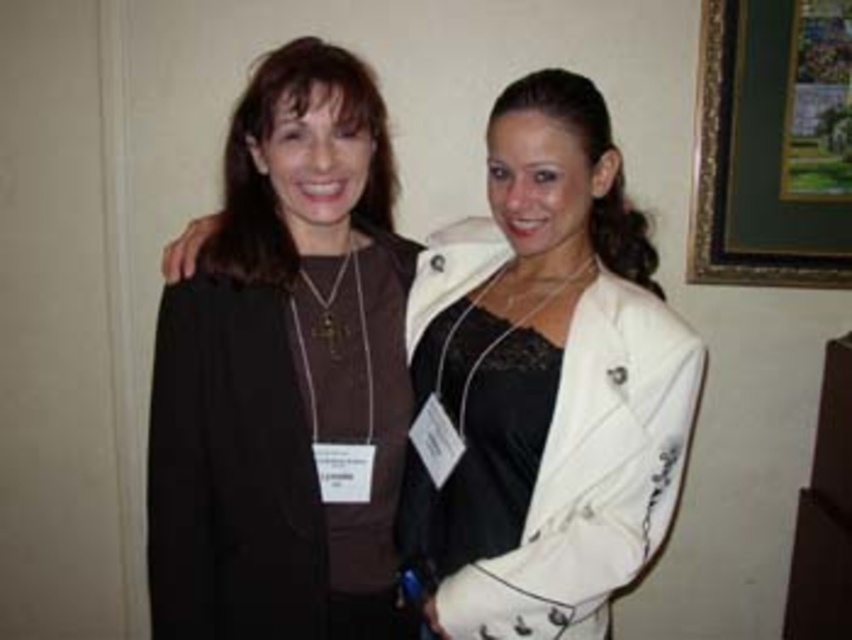
Can you confirm if matte brown sweater at center is smaller than gold-framed picture at upper right?

Actually, matte brown sweater at center might be larger than gold-framed picture at upper right.

This screenshot has height=640, width=852. What do you see at coordinates (544, 381) in the screenshot? I see `matte brown sweater at center` at bounding box center [544, 381].

Locate an element on the screen. This screenshot has width=852, height=640. matte brown sweater at center is located at coordinates (544, 381).

Does point (289, 541) come in front of point (632, 570)?

No, it is behind (632, 570).

Consider the image. Can you confirm if matte black jacket at left is bigger than matte brown sweater at center?

No.

Locate an element on the screen. The width and height of the screenshot is (852, 640). matte black jacket at left is located at coordinates (x=281, y=371).

From the picture: Is matte black jacket at left thinner than gold-framed picture at upper right?

In fact, matte black jacket at left might be wider than gold-framed picture at upper right.

Who is lower down, matte black jacket at left or gold-framed picture at upper right?

matte black jacket at left is lower down.

At what (x,y) coordinates should I click in order to perform the action: click on matte black jacket at left. Please return your answer as a coordinate pair (x, y). Image resolution: width=852 pixels, height=640 pixels. Looking at the image, I should click on (281, 371).